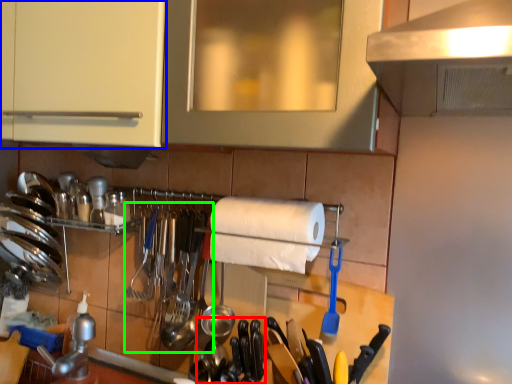
Question: Considering the real-world distances, which object is farthest from silverware (highlighted by a red box)? cabinetry (highlighted by a blue box) or silverware (highlighted by a green box)?

Choices:
 (A) cabinetry
 (B) silverware

Answer: (A)